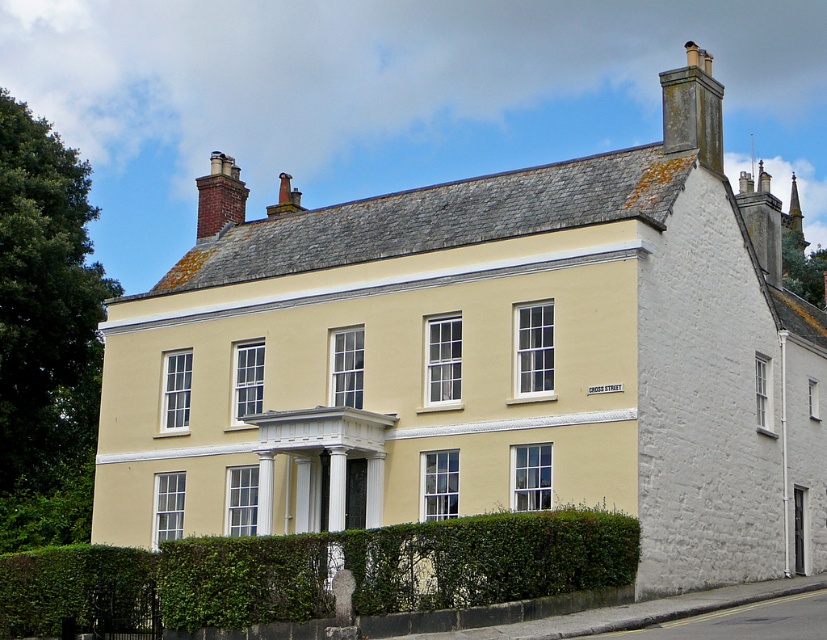
Between dark gray stone chimney at upper right and brick chimney at upper left, which one has more height?

Standing taller between the two is dark gray stone chimney at upper right.

Can you confirm if dark gray stone chimney at upper right is positioned above brick chimney at upper left?

Correct, dark gray stone chimney at upper right is located above brick chimney at upper left.

You are a GUI agent. You are given a task and a screenshot of the screen. Output one action in this format:
    pyautogui.click(x=<x>, y=<y>)
    Task: Click on the dark gray stone chimney at upper right
    The width and height of the screenshot is (827, 640).
    Given the screenshot: What is the action you would take?
    (x=692, y=108)

Between dark gray stone chimney at upper right and white stone chimney at upper right, which one appears on the right side from the viewer's perspective?

From the viewer's perspective, white stone chimney at upper right appears more on the right side.

Can you confirm if dark gray stone chimney at upper right is positioned below white stone chimney at upper right?

Incorrect, dark gray stone chimney at upper right is not positioned below white stone chimney at upper right.

Between point (719, 122) and point (778, 273), which one is positioned in front?

Point (719, 122)

The width and height of the screenshot is (827, 640). Find the location of `dark gray stone chimney at upper right`. dark gray stone chimney at upper right is located at coordinates (692, 108).

Between green leafy hedge at lower center and brick chimney at upper left, which one appears on the left side from the viewer's perspective?

brick chimney at upper left

Which is more to the right, green leafy hedge at lower center or brick chimney at upper left?

From the viewer's perspective, green leafy hedge at lower center appears more on the right side.

The width and height of the screenshot is (827, 640). Identify the location of green leafy hedge at lower center. (328, 570).

This screenshot has width=827, height=640. In order to click on green leafy hedge at lower center in this screenshot , I will do `click(328, 570)`.